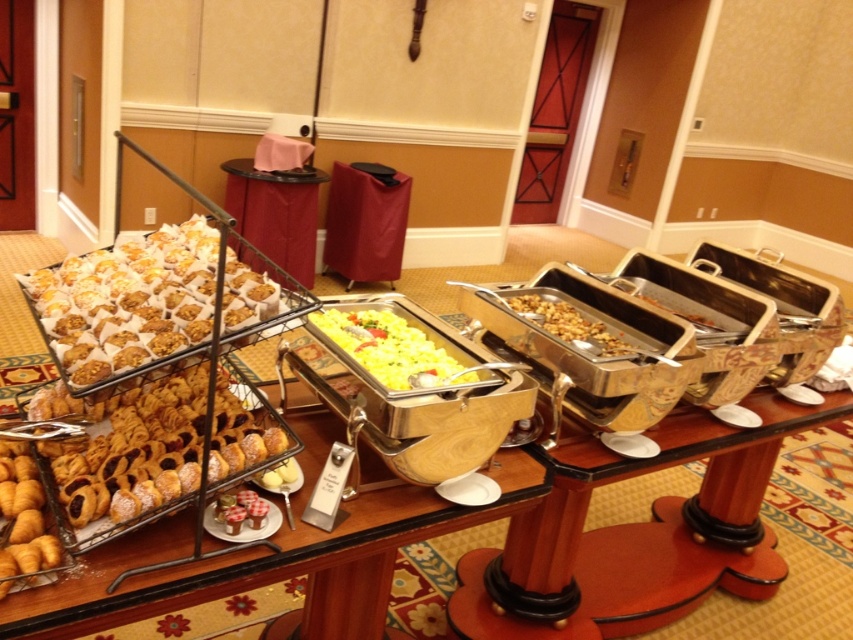
Which is more to the right, golden brown croissant at lower left or slightly browned wood at center?

slightly browned wood at center is more to the right.

Which is above, golden brown croissant at lower left or slightly browned wood at center?

Positioned higher is slightly browned wood at center.

Does point (16, 476) lie in front of point (654, 304)?

Yes, it is in front of point (654, 304).

Identify the location of golden brown croissant at lower left. (21, 518).

Is point (86, 451) closer to viewer compared to point (422, 356)?

That is True.

Image resolution: width=853 pixels, height=640 pixels. In order to click on golden brown pastry at lower left in this screenshot , I will do `click(134, 451)`.

Where is `golden brown pastry at lower left`? This screenshot has width=853, height=640. golden brown pastry at lower left is located at coordinates (134, 451).

Does yellow matte/soft scrambled eggs at center have a smaller size compared to slightly browned wood at center?

Actually, yellow matte/soft scrambled eggs at center might be larger than slightly browned wood at center.

Where is `yellow matte/soft scrambled eggs at center`? The height and width of the screenshot is (640, 853). yellow matte/soft scrambled eggs at center is located at coordinates (392, 348).

Is point (453, 381) positioned in front of point (653, 298)?

Yes, it is in front of point (653, 298).

You are a GUI agent. You are given a task and a screenshot of the screen. Output one action in this format:
    pyautogui.click(x=<x>, y=<y>)
    Task: Click on the yellow matte/soft scrambled eggs at center
    This screenshot has height=640, width=853.
    Given the screenshot: What is the action you would take?
    pyautogui.click(x=392, y=348)